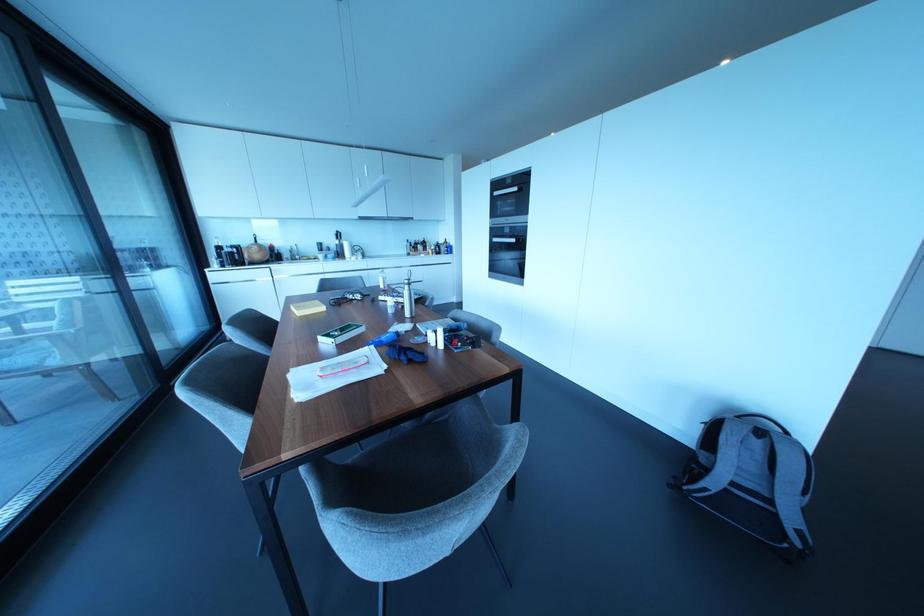
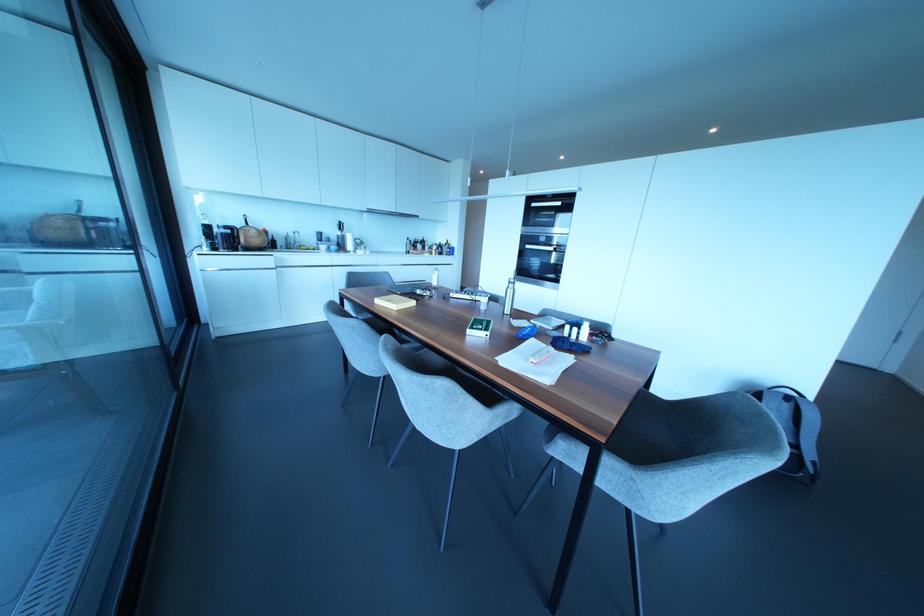
The point at (322, 308) is marked in the first image. Where is the corresponding point in the second image?

(411, 302)